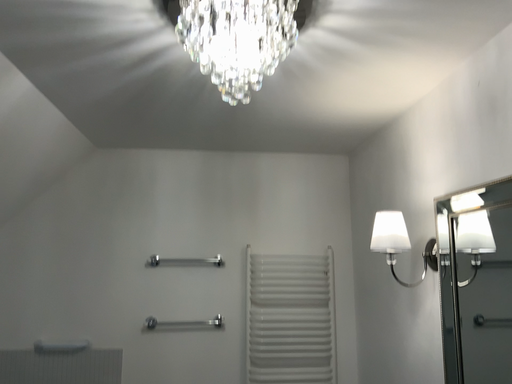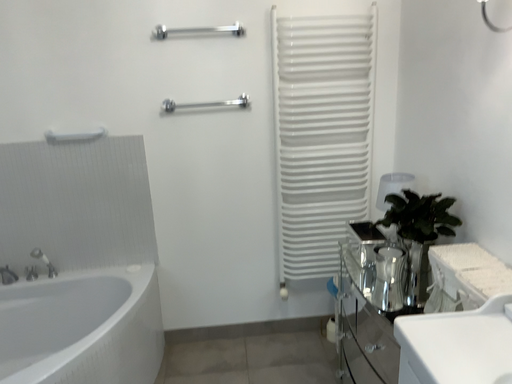
Question: How did the camera likely rotate when shooting the video?

Choices:
 (A) rotated downward
 (B) rotated upward

Answer: (A)